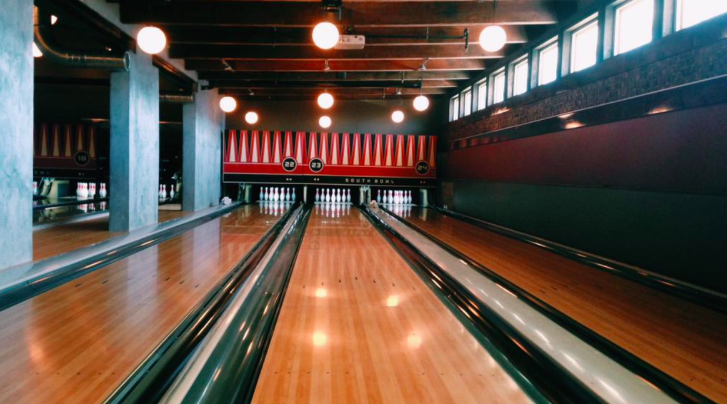
You are a GUI agent. You are given a task and a screenshot of the screen. Output one action in this format:
    pyautogui.click(x=<x>, y=<y>)
    Task: Click on the windows
    
    Given the screenshot: What is the action you would take?
    pyautogui.click(x=454, y=108), pyautogui.click(x=464, y=107), pyautogui.click(x=485, y=100), pyautogui.click(x=502, y=91), pyautogui.click(x=515, y=90), pyautogui.click(x=549, y=77), pyautogui.click(x=579, y=61), pyautogui.click(x=629, y=47), pyautogui.click(x=699, y=20)